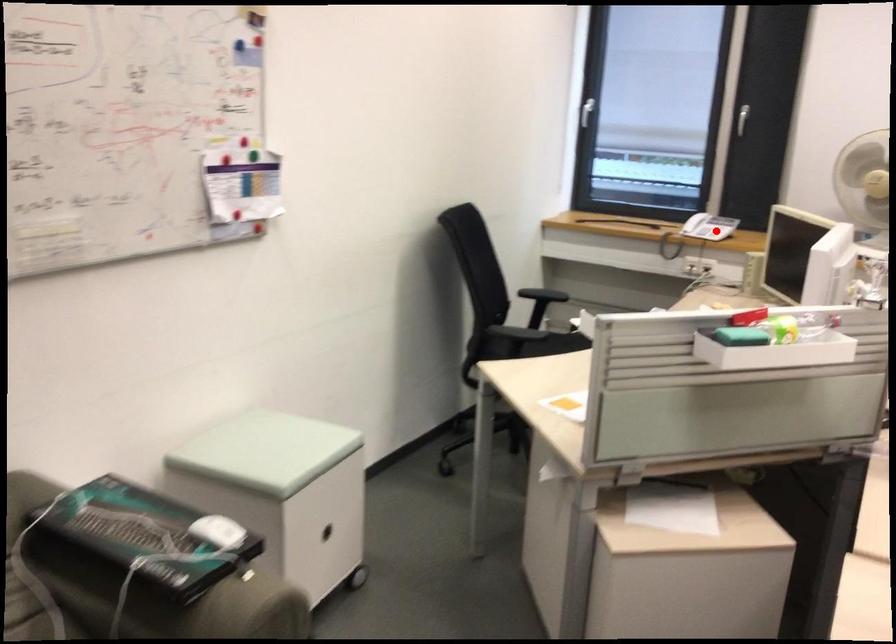
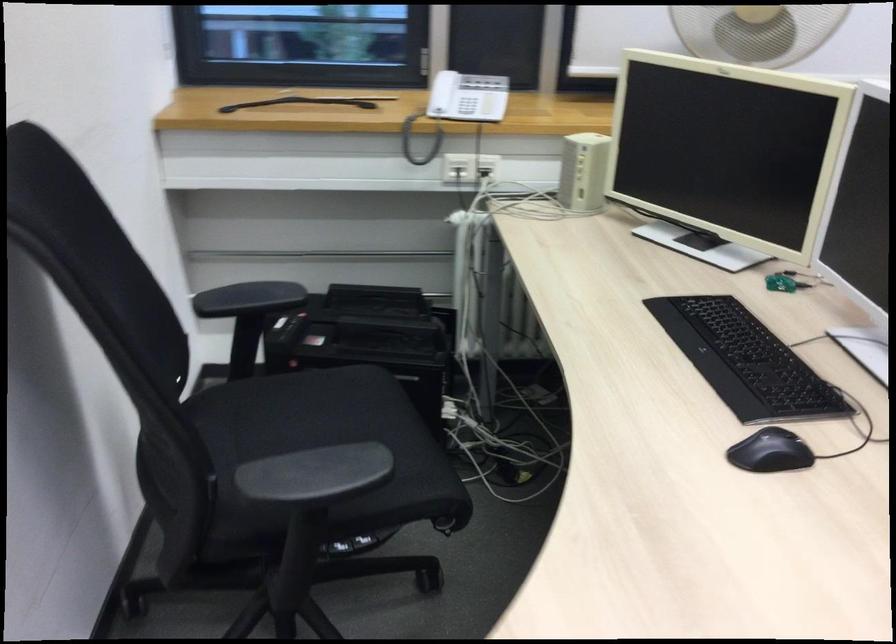
Question: A red point is marked in image1. In image2, is the corresponding 3D point closer to the camera or farther? Reply with the corresponding letter.

Choices:
 (A) The corresponding 3D point is closer.
 (B) The corresponding 3D point is farther.

Answer: (A)